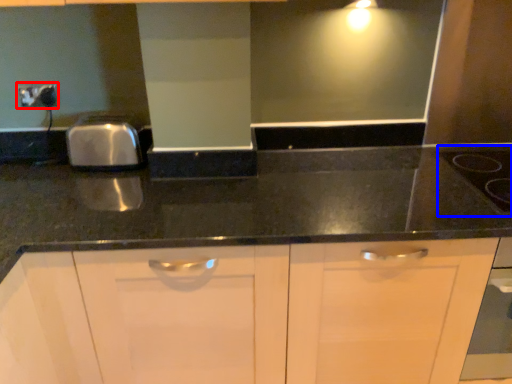
Question: Which of the following is the closest to the observer, electric outlet (highlighted by a red box) or gas stove (highlighted by a blue box)?

Choices:
 (A) electric outlet
 (B) gas stove

Answer: (B)